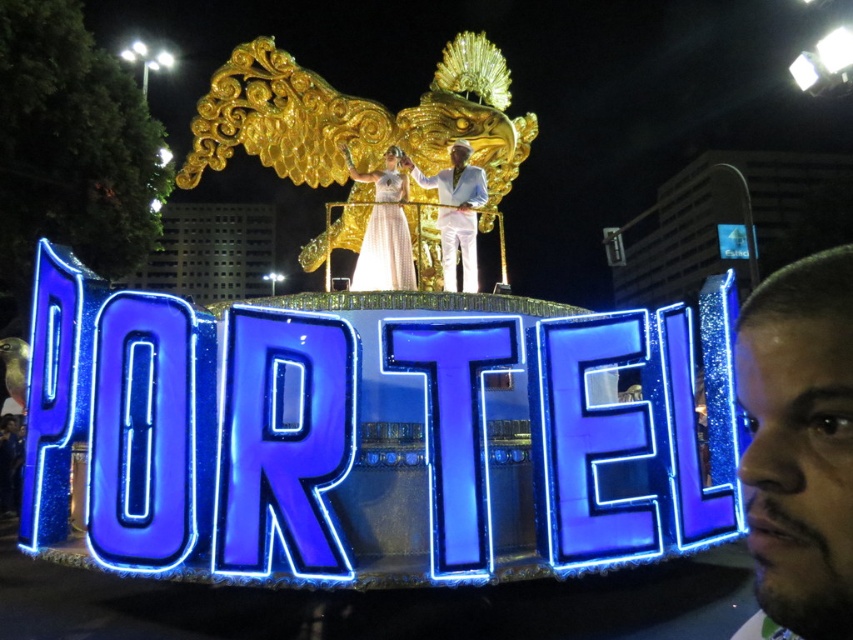
Question: Which of the following is the closest to the observer?

Choices:
 (A) (482, 202)
 (B) (375, 204)
 (C) (762, 550)

Answer: (C)

Question: Can you confirm if dark brown hair at lower right is thinner than white satin suit at center?

Choices:
 (A) no
 (B) yes

Answer: (A)

Question: Which of the following is the farthest from the observer?

Choices:
 (A) (817, 323)
 (B) (407, 246)

Answer: (B)

Question: Where is pearl-like fabric dress at center located in relation to white satin suit at center in the image?

Choices:
 (A) right
 (B) left

Answer: (B)

Question: Does dark brown hair at lower right have a smaller size compared to pearl-like fabric dress at center?

Choices:
 (A) no
 (B) yes

Answer: (A)

Question: Which point appears closest to the camera in this image?

Choices:
 (A) (438, 182)
 (B) (809, 419)

Answer: (B)